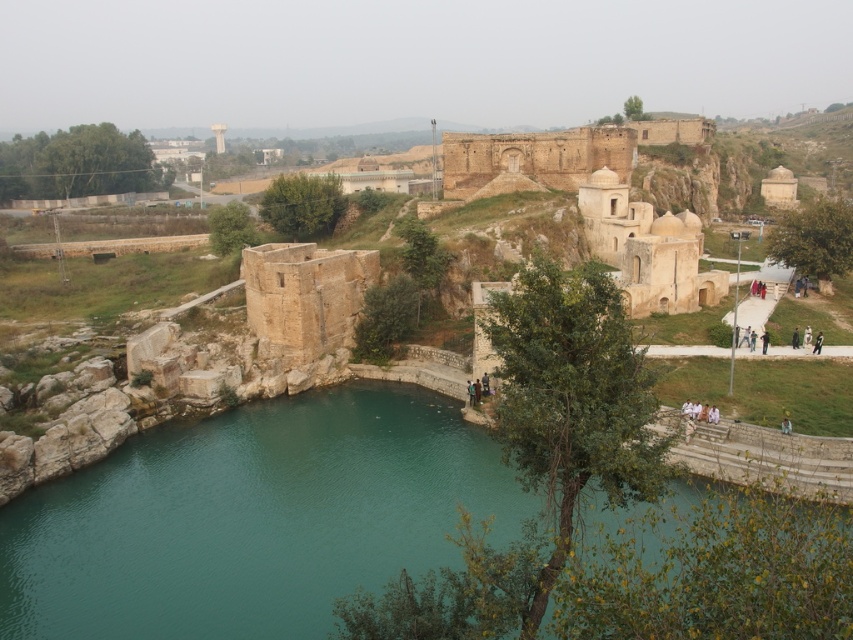
Is brown stone palace at center wider than green stone river at center?

Incorrect, brown stone palace at center's width does not surpass green stone river at center's.

Is point (579, 164) less distant than point (775, 390)?

No.

Is point (547, 177) less distant than point (689, 380)?

No, it is behind (689, 380).

In order to click on brown stone palace at center in this screenshot , I will do pyautogui.click(x=535, y=156).